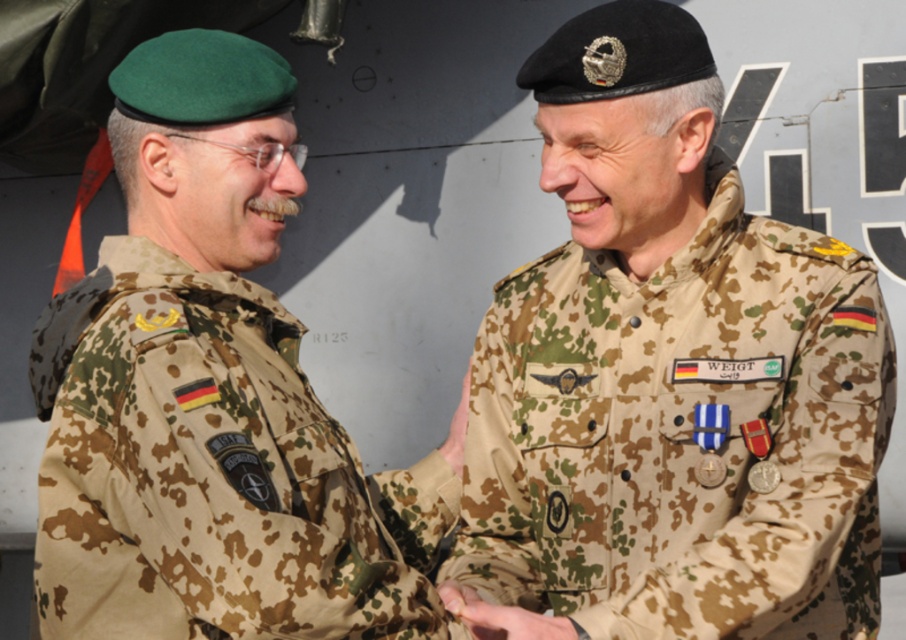
Question: Does camouflage uniform at center have a smaller size compared to camouflage uniform at left?

Choices:
 (A) no
 (B) yes

Answer: (A)

Question: Does camouflage uniform at center have a greater width compared to camouflage uniform at left?

Choices:
 (A) no
 (B) yes

Answer: (B)

Question: Is camouflage uniform at center to the right of camouflage uniform at left from the viewer's perspective?

Choices:
 (A) no
 (B) yes

Answer: (B)

Question: Which point appears closest to the camera in this image?

Choices:
 (A) (829, 264)
 (B) (153, 317)

Answer: (B)

Question: Which of the following is the farthest from the observer?

Choices:
 (A) camouflage uniform at left
 (B) camouflage uniform at center

Answer: (B)